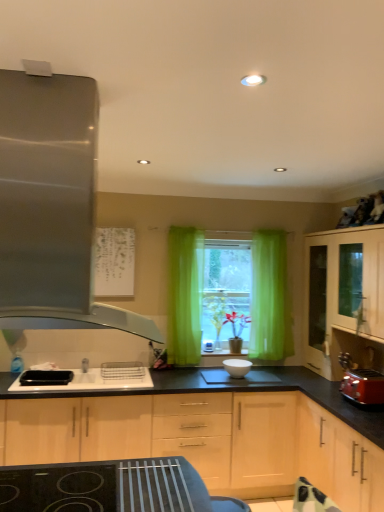
Question: Does light wood cabinet at right, the 1th cabinetry when ordered from right to left, turn towards matte red toaster at right?

Choices:
 (A) no
 (B) yes

Answer: (A)

Question: Can you confirm if light wood cabinet at right, which ranks as the 3th cabinetry in left-to-right order, is bigger than matte red toaster at right?

Choices:
 (A) no
 (B) yes

Answer: (B)

Question: Is light wood cabinet at right, which ranks as the 3th cabinetry in left-to-right order, directly adjacent to matte red toaster at right?

Choices:
 (A) yes
 (B) no

Answer: (B)

Question: From the image's perspective, is light wood cabinet at right, the 1th cabinetry when ordered from right to left, above matte red toaster at right?

Choices:
 (A) yes
 (B) no

Answer: (A)

Question: Is light wood cabinet at right, which ranks as the 3th cabinetry in left-to-right order, far from matte red toaster at right?

Choices:
 (A) yes
 (B) no

Answer: (B)

Question: Is matte red toaster at right surrounded by light wood cabinet at right, which ranks as the 3th cabinetry in left-to-right order?

Choices:
 (A) yes
 (B) no

Answer: (B)

Question: Can you confirm if black plastic sink at center is taller than light wood cabinet at right, the 1th cabinetry when ordered from right to left?

Choices:
 (A) yes
 (B) no

Answer: (B)

Question: Does black plastic sink at center appear on the left side of light wood cabinet at right, which ranks as the 3th cabinetry in left-to-right order?

Choices:
 (A) yes
 (B) no

Answer: (A)

Question: Does black plastic sink at center turn towards light wood cabinet at right, the 1th cabinetry when ordered from right to left?

Choices:
 (A) no
 (B) yes

Answer: (A)

Question: Is black plastic sink at center positioned before light wood cabinet at right, the 1th cabinetry when ordered from right to left?

Choices:
 (A) yes
 (B) no

Answer: (A)

Question: Can light wood cabinet at right, which ranks as the 3th cabinetry in left-to-right order, be found inside black plastic sink at center?

Choices:
 (A) no
 (B) yes

Answer: (A)

Question: Is black plastic sink at center wider than light wood cabinet at right, which ranks as the 3th cabinetry in left-to-right order?

Choices:
 (A) yes
 (B) no

Answer: (A)

Question: Is matte red toaster at right to the left of black plastic sink at center from the viewer's perspective?

Choices:
 (A) no
 (B) yes

Answer: (A)